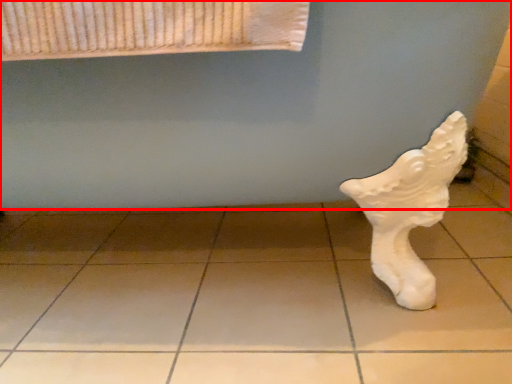
Question: Considering the relative positions of bath (annotated by the red box) and tile in the image provided, where is bath (annotated by the red box) located with respect to the staircase?

Choices:
 (A) right
 (B) left

Answer: (B)